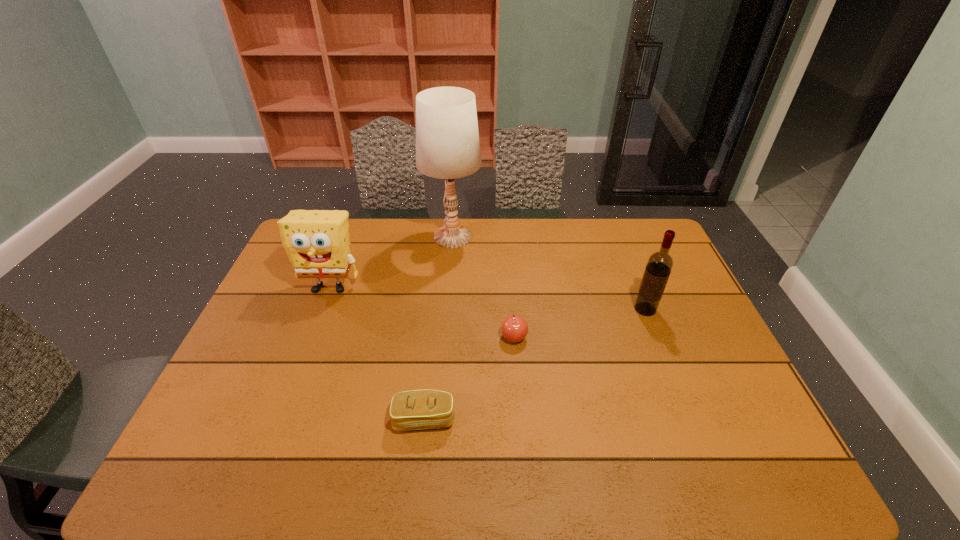
You are a GUI agent. You are given a task and a screenshot of the screen. Output one action in this format:
    pyautogui.click(x=<x>, y=<y>)
    Task: Click on the vacant space at the far right corner
    
    Given the screenshot: What is the action you would take?
    pyautogui.click(x=642, y=248)

Where is `free space between the second nearest object and the nearest object`? The height and width of the screenshot is (540, 960). free space between the second nearest object and the nearest object is located at coordinates (469, 378).

You are a GUI agent. You are given a task and a screenshot of the screen. Output one action in this format:
    pyautogui.click(x=<x>, y=<y>)
    Task: Click on the free space between the leftmost object and the nearest object
    
    Given the screenshot: What is the action you would take?
    pyautogui.click(x=377, y=353)

The image size is (960, 540). In order to click on vacant space that's between the wine bottle and the shortest object in this screenshot , I will do `click(535, 364)`.

Where is `blank region between the wine bottle and the nearest object`? blank region between the wine bottle and the nearest object is located at coordinates (535, 364).

You are a GUI agent. You are given a task and a screenshot of the screen. Output one action in this format:
    pyautogui.click(x=<x>, y=<y>)
    Task: Click on the free space between the wine bottle and the clutch bag
    This screenshot has height=540, width=960.
    Given the screenshot: What is the action you would take?
    pyautogui.click(x=535, y=364)

I want to click on vacant area that lies between the rightmost object and the shortest object, so click(535, 364).

The image size is (960, 540). I want to click on free space that is in between the shortest object and the wine bottle, so click(535, 364).

Where is `free space between the tallest object and the fourth farthest object`? The height and width of the screenshot is (540, 960). free space between the tallest object and the fourth farthest object is located at coordinates (483, 287).

Where is `free point between the sponge and the clutch bag`? The height and width of the screenshot is (540, 960). free point between the sponge and the clutch bag is located at coordinates (377, 353).